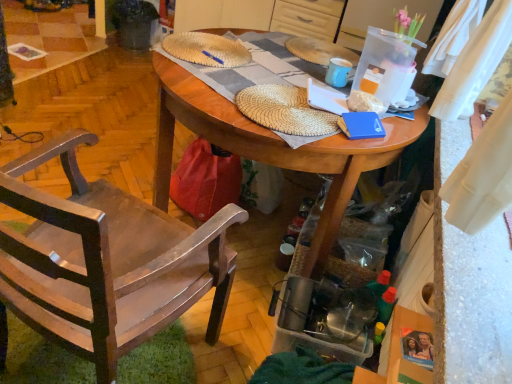
Question: In terms of width, does blue matte book at center look wider or thinner when compared to dark gray plastic trash can at upper left?

Choices:
 (A) wide
 (B) thin

Answer: (B)

Question: From a real-world perspective, is blue matte book at center positioned above or below dark gray plastic trash can at upper left?

Choices:
 (A) below
 (B) above

Answer: (B)

Question: Which is farther from the blue matte book at center?

Choices:
 (A) woven straw hat at upper center, marked as the second hat in a front-to-back arrangement
 (B) blue plastic pen at center
 (C) matte blue mug at upper center
 (D) dark gray plastic trash can at upper left
 (E) woven straw hat at center, which is the second hat from back to front

Answer: (D)

Question: Which object is the farthest from the woven straw hat at upper center, marked as the second hat in a front-to-back arrangement?

Choices:
 (A) woven straw hat at center, which is the second hat from back to front
 (B) matte blue mug at upper center
 (C) wooden table at center
 (D) dark gray plastic trash can at upper left
 (E) wooden chair at left

Answer: (D)